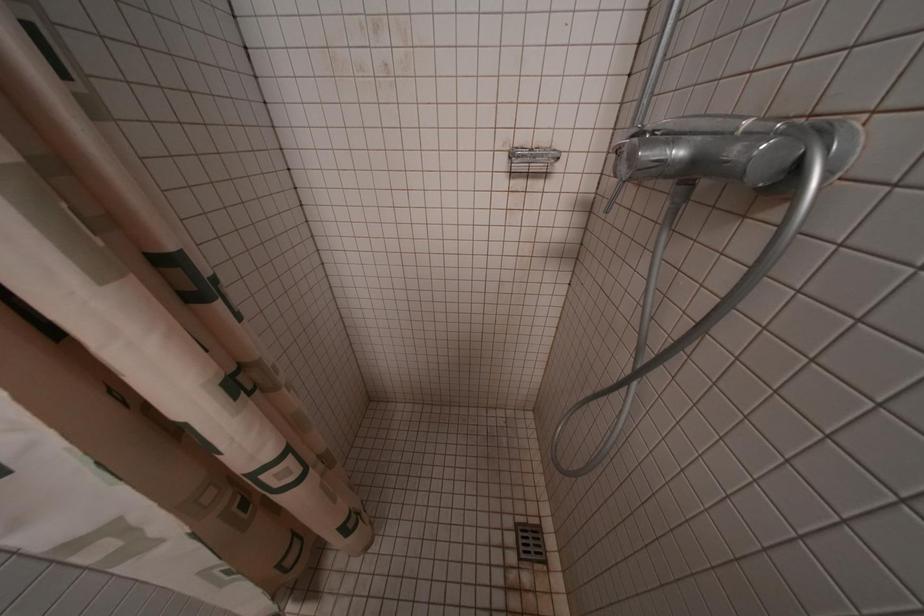
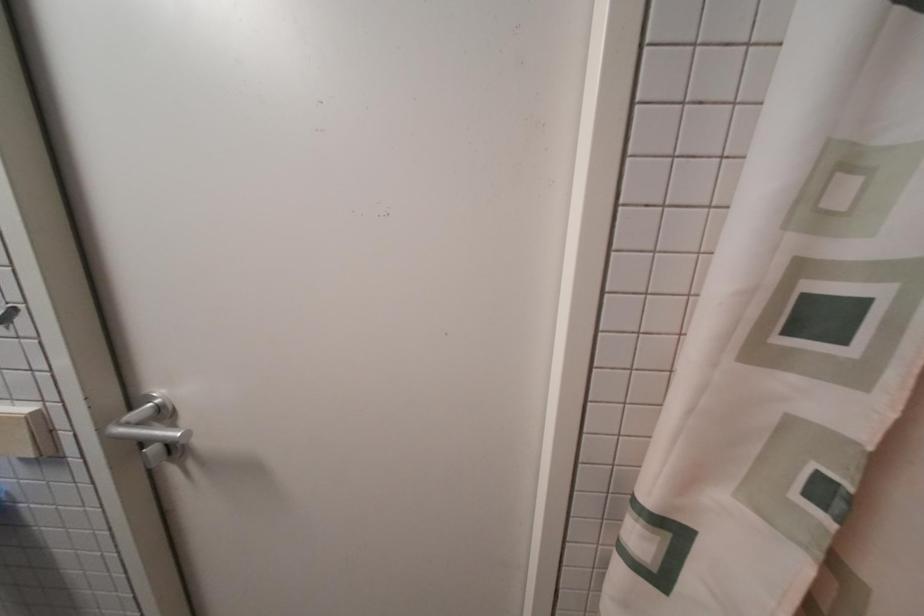
Question: Based on the continuous images, in which direction is the camera rotating? Reply with the corresponding letter.

Choices:
 (A) Left
 (B) Right
 (C) Up
 (D) Down

Answer: (A)